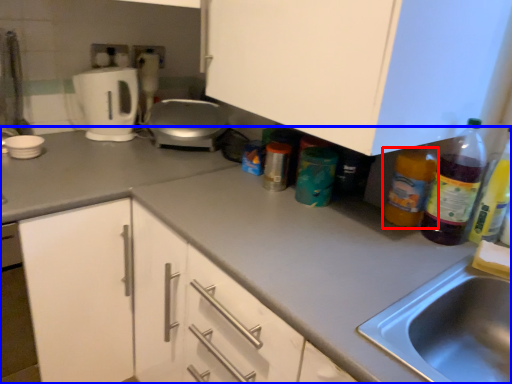
Question: Among these objects, which one is nearest to the camera, bottle (highlighted by a red box) or countertop (highlighted by a blue box)?

Choices:
 (A) bottle
 (B) countertop

Answer: (B)